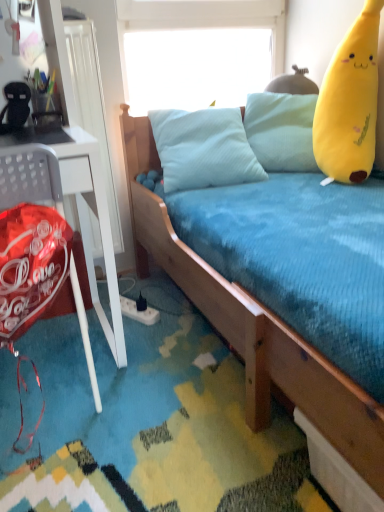
Question: From the image's perspective, would you say wooden bed at center is shown under shiny red balloon at left?

Choices:
 (A) no
 (B) yes

Answer: (A)

Question: From a real-world perspective, is wooden bed at center on top of shiny red balloon at left?

Choices:
 (A) yes
 (B) no

Answer: (A)

Question: Considering the relative sizes of wooden bed at center and shiny red balloon at left in the image provided, is wooden bed at center taller than shiny red balloon at left?

Choices:
 (A) yes
 (B) no

Answer: (B)

Question: Is wooden bed at center facing towards shiny red balloon at left?

Choices:
 (A) no
 (B) yes

Answer: (A)

Question: Is wooden bed at center oriented away from shiny red balloon at left?

Choices:
 (A) yes
 (B) no

Answer: (B)

Question: Is wooden bed at center at the right side of shiny red balloon at left?

Choices:
 (A) no
 (B) yes

Answer: (B)

Question: Is transparent plastic window screen at upper center placed right next to shiny red balloon at left?

Choices:
 (A) no
 (B) yes

Answer: (A)

Question: Considering the relative sizes of transparent plastic window screen at upper center and shiny red balloon at left in the image provided, is transparent plastic window screen at upper center wider than shiny red balloon at left?

Choices:
 (A) no
 (B) yes

Answer: (A)

Question: From a real-world perspective, is transparent plastic window screen at upper center under shiny red balloon at left?

Choices:
 (A) yes
 (B) no

Answer: (B)

Question: From the image's perspective, is transparent plastic window screen at upper center on top of shiny red balloon at left?

Choices:
 (A) yes
 (B) no

Answer: (A)

Question: Is transparent plastic window screen at upper center outside of shiny red balloon at left?

Choices:
 (A) yes
 (B) no

Answer: (A)

Question: Would you say shiny red balloon at left is part of transparent plastic window screen at upper center's contents?

Choices:
 (A) no
 (B) yes

Answer: (A)

Question: Considering the relative sizes of shiny red balloon at left and wooden bed at center in the image provided, is shiny red balloon at left bigger than wooden bed at center?

Choices:
 (A) no
 (B) yes

Answer: (A)